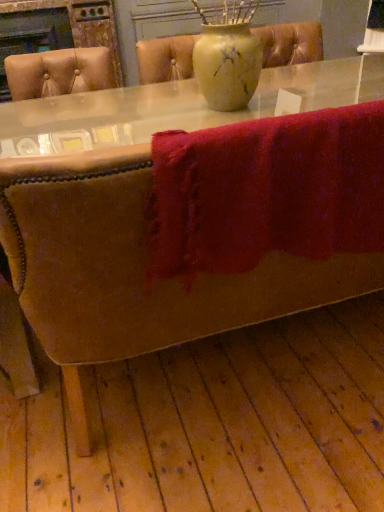
Question: In terms of size, does matte yellow vase at center appear bigger or smaller than fuzzy red towel at lower center?

Choices:
 (A) big
 (B) small

Answer: (A)

Question: Is matte yellow vase at center situated inside fuzzy red towel at lower center or outside?

Choices:
 (A) outside
 (B) inside

Answer: (A)

Question: Considering their positions, is matte yellow vase at center located in front of or behind fuzzy red towel at lower center?

Choices:
 (A) behind
 (B) front

Answer: (A)

Question: Based on their sizes in the image, would you say fuzzy red towel at lower center is bigger or smaller than matte yellow vase at center?

Choices:
 (A) big
 (B) small

Answer: (B)

Question: Which is correct: fuzzy red towel at lower center is inside matte yellow vase at center, or outside of it?

Choices:
 (A) inside
 (B) outside

Answer: (B)

Question: Considering the positions of fuzzy red towel at lower center and matte yellow vase at center in the image, is fuzzy red towel at lower center wider or thinner than matte yellow vase at center?

Choices:
 (A) wide
 (B) thin

Answer: (B)

Question: Relative to matte yellow vase at center, is fuzzy red towel at lower center in front or behind?

Choices:
 (A) front
 (B) behind

Answer: (A)